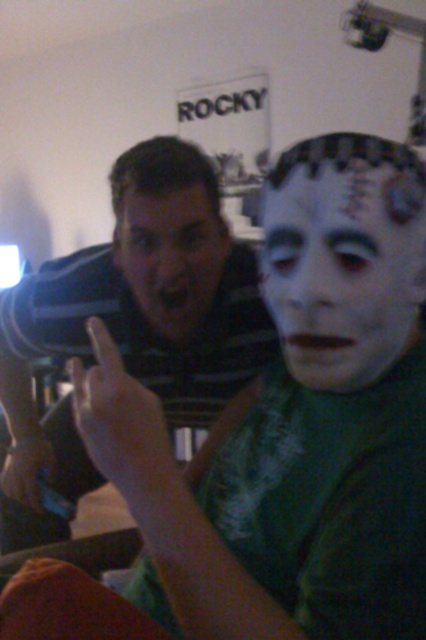
Question: Is white matte face at center below matte black face at center?

Choices:
 (A) no
 (B) yes

Answer: (B)

Question: Does white matte face at center lie behind matte black face at center?

Choices:
 (A) no
 (B) yes

Answer: (A)

Question: Estimate the real-world distances between objects in this image. Which object is farther from the white matte face at center?

Choices:
 (A) matte black face at center
 (B) striped shirt at center

Answer: (B)

Question: Can you confirm if striped shirt at center is positioned below matte black face at center?

Choices:
 (A) yes
 (B) no

Answer: (A)

Question: Among these points, which one is nearest to the camera?

Choices:
 (A) (299, 332)
 (B) (155, 168)
 (C) (189, 227)

Answer: (A)

Question: Estimate the real-world distances between objects in this image. Which object is closer to the matte black face at center?

Choices:
 (A) striped shirt at center
 (B) white matte face at center

Answer: (A)